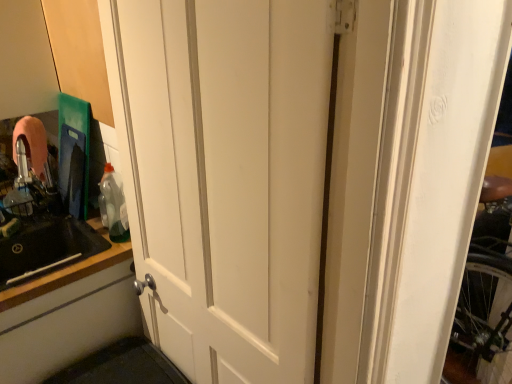
Question: Is black matte countertop at left closer to camera compared to black matte sink at left?

Choices:
 (A) no
 (B) yes

Answer: (A)

Question: From a real-world perspective, does black matte countertop at left stand above black matte sink at left?

Choices:
 (A) no
 (B) yes

Answer: (A)

Question: Would you say black matte countertop at left is a long distance from black matte sink at left?

Choices:
 (A) no
 (B) yes

Answer: (A)

Question: Is black matte countertop at left oriented away from black matte sink at left?

Choices:
 (A) yes
 (B) no

Answer: (A)

Question: Does black matte countertop at left have a larger size compared to black matte sink at left?

Choices:
 (A) no
 (B) yes

Answer: (A)

Question: Does black matte countertop at left have a greater height compared to black matte sink at left?

Choices:
 (A) yes
 (B) no

Answer: (B)

Question: Is black matte countertop at left shorter than translucent plastic bottle at left?

Choices:
 (A) no
 (B) yes

Answer: (A)

Question: Is black matte countertop at left to the left of translucent plastic bottle at left from the viewer's perspective?

Choices:
 (A) yes
 (B) no

Answer: (A)

Question: Is black matte countertop at left aimed at translucent plastic bottle at left?

Choices:
 (A) yes
 (B) no

Answer: (B)

Question: From a real-world perspective, is black matte countertop at left on translucent plastic bottle at left?

Choices:
 (A) no
 (B) yes

Answer: (A)

Question: Could translucent plastic bottle at left be considered to be inside black matte countertop at left?

Choices:
 (A) yes
 (B) no

Answer: (B)

Question: Is black matte countertop at left positioned beyond the bounds of translucent plastic bottle at left?

Choices:
 (A) no
 (B) yes

Answer: (B)

Question: Does white matte cabinet door at lower left come in front of black matte countertop at left?

Choices:
 (A) no
 (B) yes

Answer: (B)